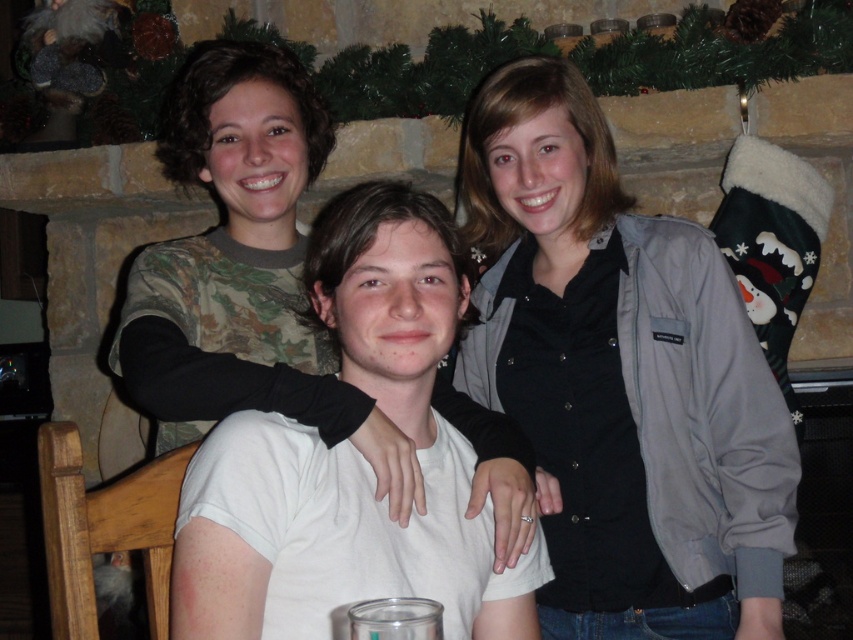
You are a photographer setting up for a group photo in the living room. You need to ensure that the gray fabric jacket at upper right is within the camera frame. The camera has a focal length of 5 feet. Can the jacket be captured clearly?

The gray fabric jacket at upper right is 4.56 feet from the camera, which is within the 5 feet focal length. Therefore, the jacket can be captured clearly in the photo.